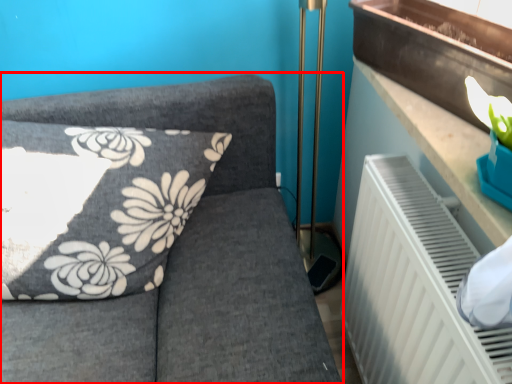
Question: From the image's perspective, considering the relative positions of furniture (annotated by the red box) and window sill in the image provided, where is furniture (annotated by the red box) located with respect to the staircase?

Choices:
 (A) above
 (B) below

Answer: (B)